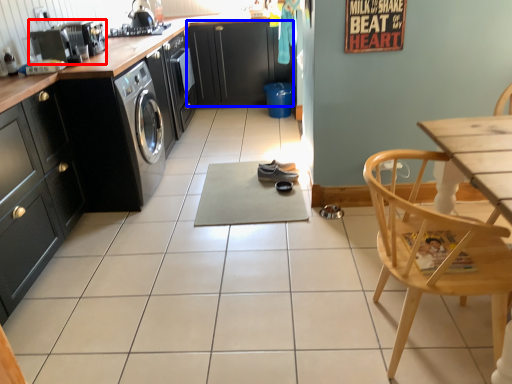
Question: Which of the following is the closest to the observer, kitchen appliance (highlighted by a red box) or cabinetry (highlighted by a blue box)?

Choices:
 (A) kitchen appliance
 (B) cabinetry

Answer: (A)